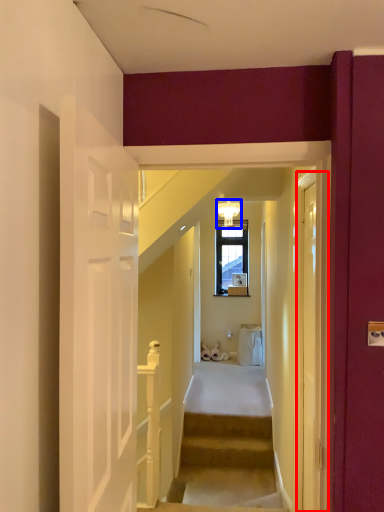
Question: Which object appears farthest to the camera in this image, glass door (highlighted by a red box) or light fixture (highlighted by a blue box)?

Choices:
 (A) glass door
 (B) light fixture

Answer: (B)